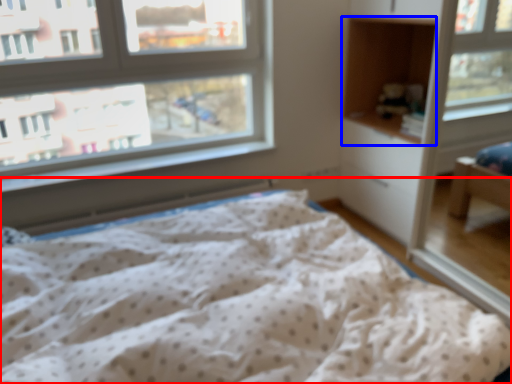
Question: Which object is closer to the camera taking this photo, bed (highlighted by a red box) or cabinet (highlighted by a blue box)?

Choices:
 (A) bed
 (B) cabinet

Answer: (A)